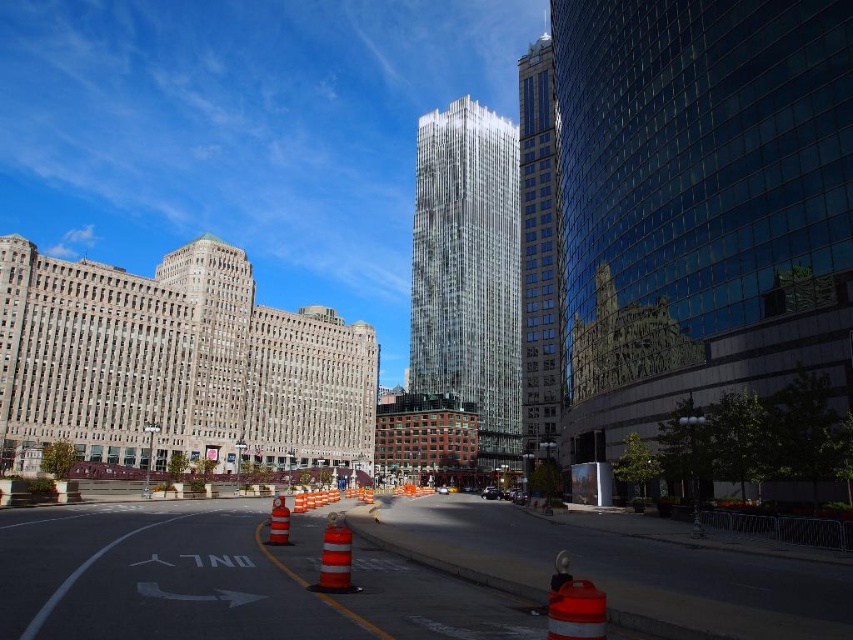
You are a city planner assessing the distance between the shiny glass skyscraper at center and the reflective orange traffic cone at center for a new pedestrian walkway. Given that the minimum required distance for safety is 150 feet, will the current spacing meet the safety standards?

The shiny glass skyscraper at center and reflective orange traffic cone at center are 183.90 feet apart, which exceeds the minimum required distance of 150 feet for safety. Therefore, the current spacing meets the safety standards.

You are a photographer standing in the middle of the street. You want to take a photo that includes both the clear glass skyscraper at center and the orange reflective cone at center. Which object should you position closer to the camera to ensure both are in focus?

To ensure both the clear glass skyscraper at center and the orange reflective cone at center are in focus, you should position the orange reflective cone at center closer to the camera since the skyscraper is further away.